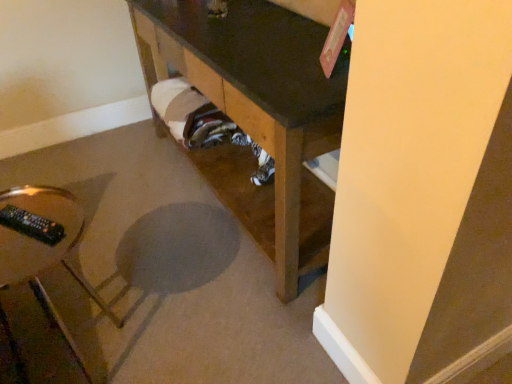
The height and width of the screenshot is (384, 512). I want to click on empty space that is to the right of clear glass remote control at lower left, arranged as the 2th furniture when viewed from the right, so click(186, 329).